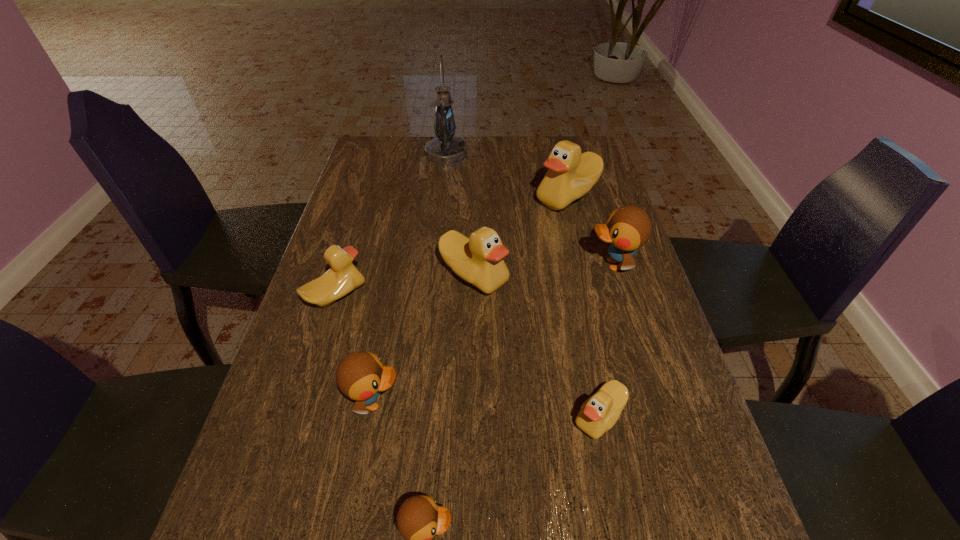
At what (x,y) coordinates should I click in order to perform the action: click on the leftmost object. Please return your answer as a coordinate pair (x, y). This screenshot has width=960, height=540. Looking at the image, I should click on [x=343, y=277].

Find the location of a particular element. The image size is (960, 540). the smallest beige duck is located at coordinates (599, 413).

The height and width of the screenshot is (540, 960). In order to click on free spot located 0.270m on the right of the oil lamp in this screenshot , I will do `click(543, 153)`.

Find the location of a particular element. vacant region located at the beak of the farthest beige duck is located at coordinates (449, 197).

Locate an element on the screen. The height and width of the screenshot is (540, 960). vacant space located at the beak of the farthest beige duck is located at coordinates (471, 197).

Locate an element on the screen. vacant space located at the beak of the farthest beige duck is located at coordinates (490, 197).

The image size is (960, 540). I want to click on vacant region located 0.050m on the front-facing side of the rightmost blue duck, so click(x=567, y=265).

This screenshot has width=960, height=540. In order to click on vacant point located 0.330m on the front-facing side of the rightmost blue duck in this screenshot , I will do `click(463, 265)`.

The height and width of the screenshot is (540, 960). Find the location of `vacant area situated on the front-facing side of the rightmost blue duck`. vacant area situated on the front-facing side of the rightmost blue duck is located at coordinates (485, 265).

The image size is (960, 540). What are the coordinates of `free location located at the beak of the third smallest beige duck` in the screenshot? It's located at (472, 383).